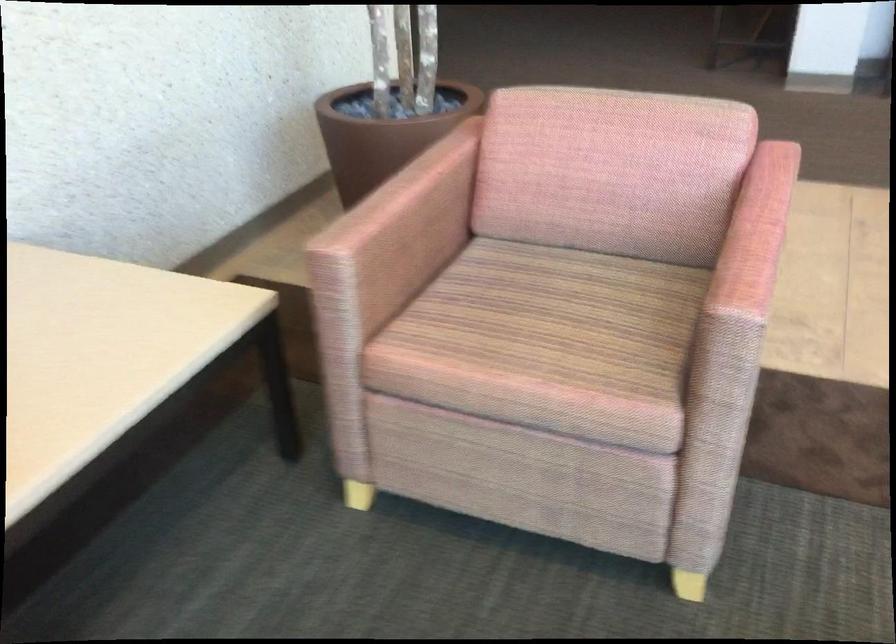
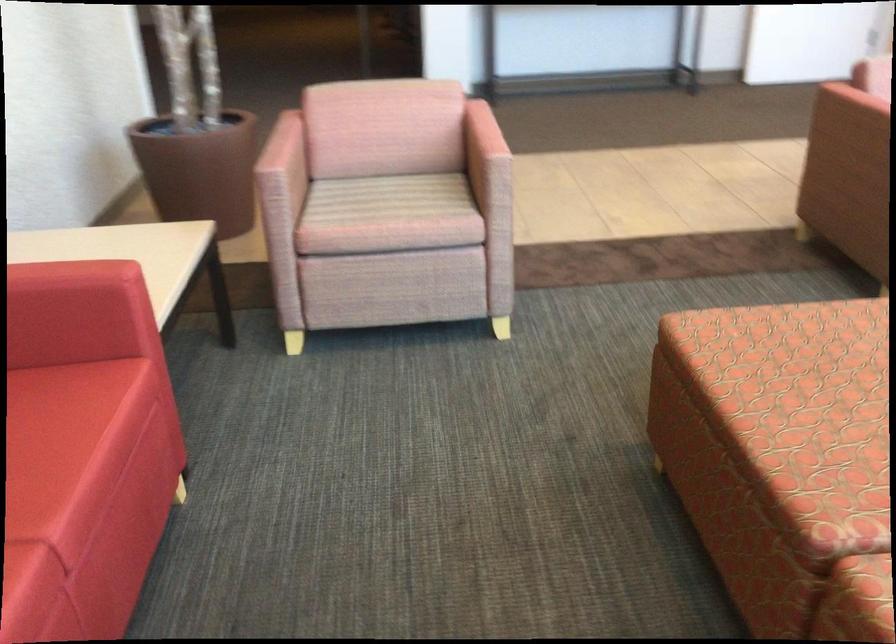
Locate, in the second image, the point that corresponds to the point at 346,267 in the first image.

(280, 176)